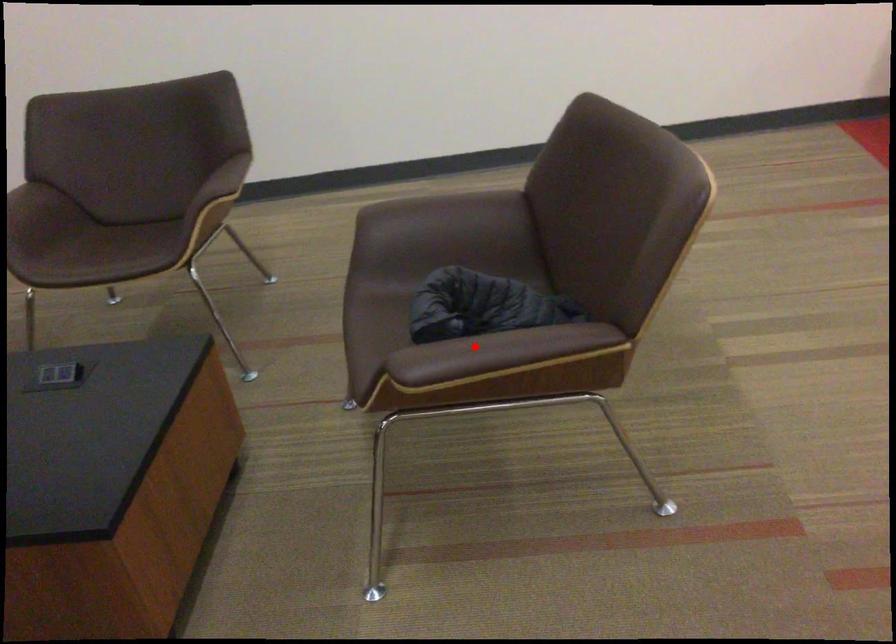
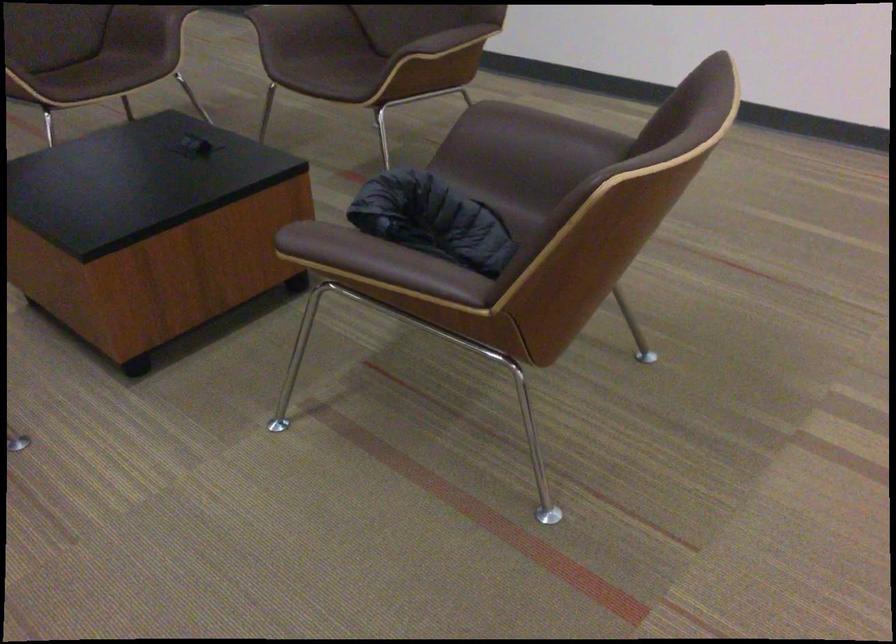
Find the pixel in the second image that matches the highlighted location in the first image.

(355, 250)